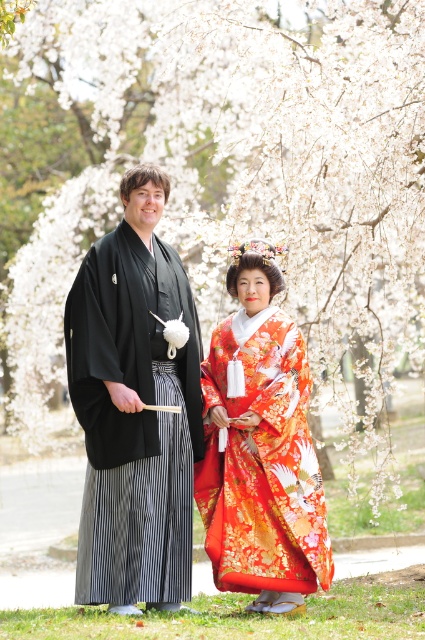
Does black silk kimono at center have a lesser height compared to silky orange kimono at center?

No, black silk kimono at center is not shorter than silky orange kimono at center.

Between point (172, 584) and point (272, 289), which one is positioned in front?

Point (172, 584) is more forward.

Where is `black silk kimono at center`? black silk kimono at center is located at coordinates [135, 406].